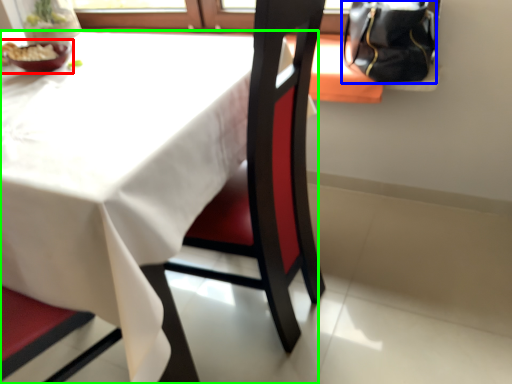
Question: Based on their relative distances, which object is nearer to tableware (highlighted by a red box)? Choose from handbag (highlighted by a blue box) and table (highlighted by a green box).

Choices:
 (A) handbag
 (B) table

Answer: (B)